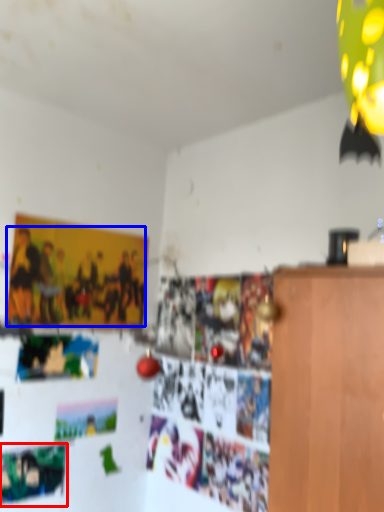
Question: Which object appears farthest to the camera in this image, poster (highlighted by a red box) or person (highlighted by a blue box)?

Choices:
 (A) poster
 (B) person

Answer: (B)